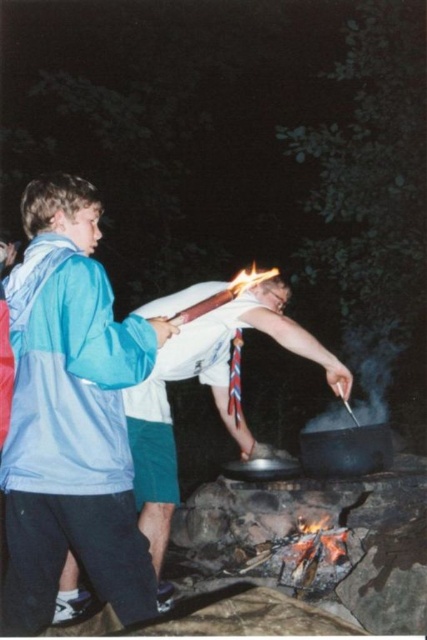
Question: Which of the following is the farthest from the observer?

Choices:
 (A) white fabric shirt at center
 (B) blue fabric jacket at left

Answer: (A)

Question: In this image, where is blue fabric jacket at left located relative to white fabric shirt at center?

Choices:
 (A) right
 (B) left

Answer: (B)

Question: Can you confirm if blue fabric jacket at left is wider than white fabric shirt at center?

Choices:
 (A) no
 (B) yes

Answer: (A)

Question: Among these objects, which one is nearest to the camera?

Choices:
 (A) white fabric shirt at center
 (B) blue fabric jacket at left

Answer: (B)

Question: Among these objects, which one is nearest to the camera?

Choices:
 (A) blue fabric jacket at left
 (B) white fabric shirt at center

Answer: (A)

Question: Does blue fabric jacket at left appear on the right side of white fabric shirt at center?

Choices:
 (A) yes
 (B) no

Answer: (B)